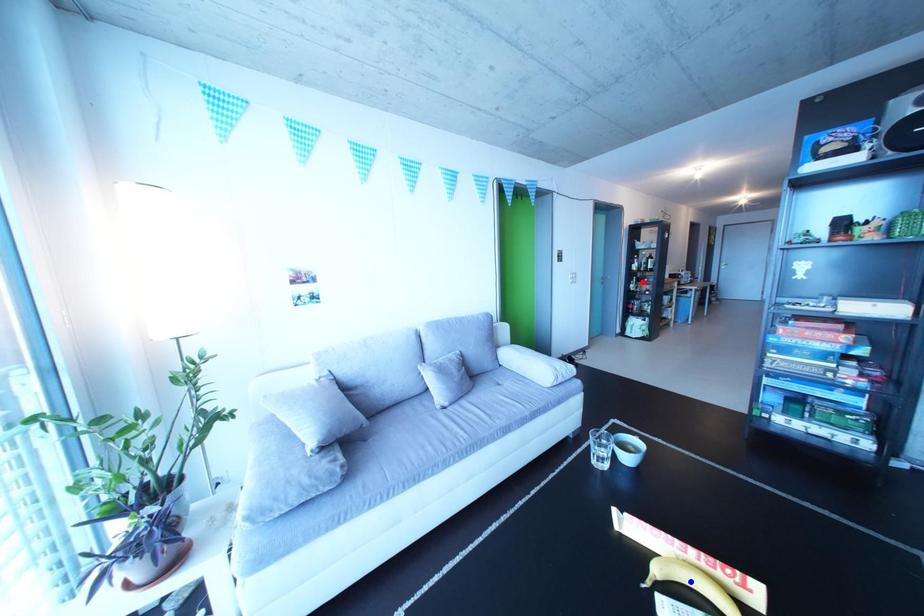
Question: Which of the two points in the image is closer to the camera?

Choices:
 (A) Blue point is closer.
 (B) Red point is closer.

Answer: (A)